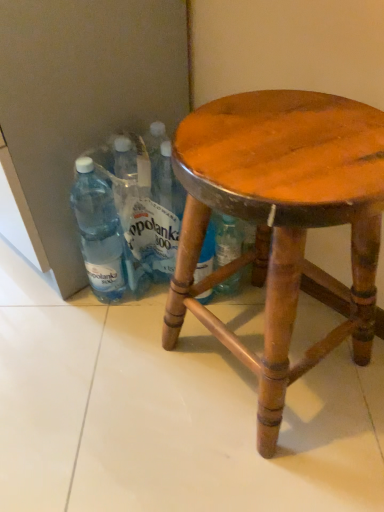
The width and height of the screenshot is (384, 512). In order to click on vacant region under wooden stool at center (from a real-world perspective) in this screenshot , I will do `click(253, 357)`.